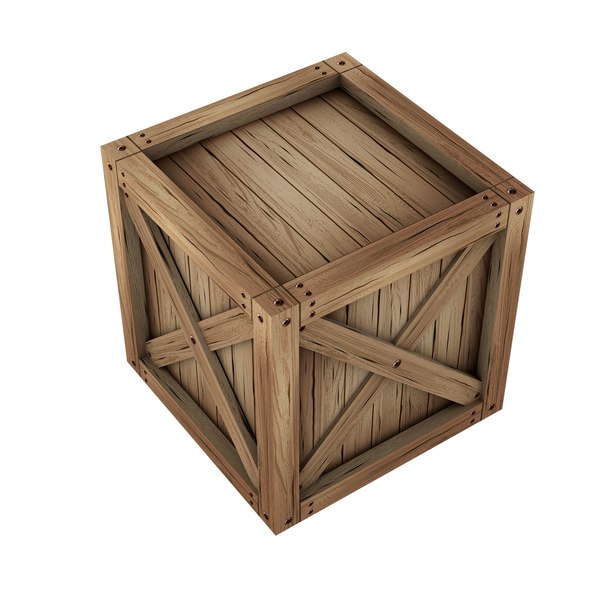
In order to click on wooden slats that make the wall in this screenshot , I will do `click(283, 236)`, `click(443, 340)`.